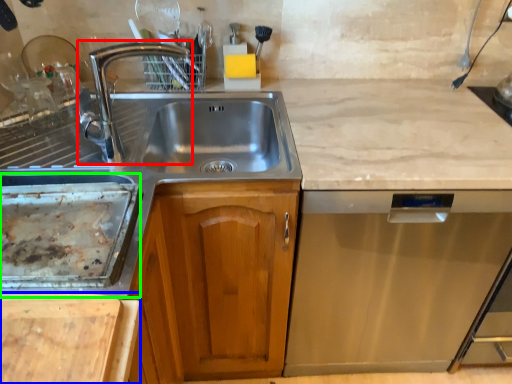
Question: Which object is positioned farthest from tap (highlighted by a red box)? Select from cutting board (highlighted by a blue box) and appliance (highlighted by a green box).

Choices:
 (A) cutting board
 (B) appliance

Answer: (A)